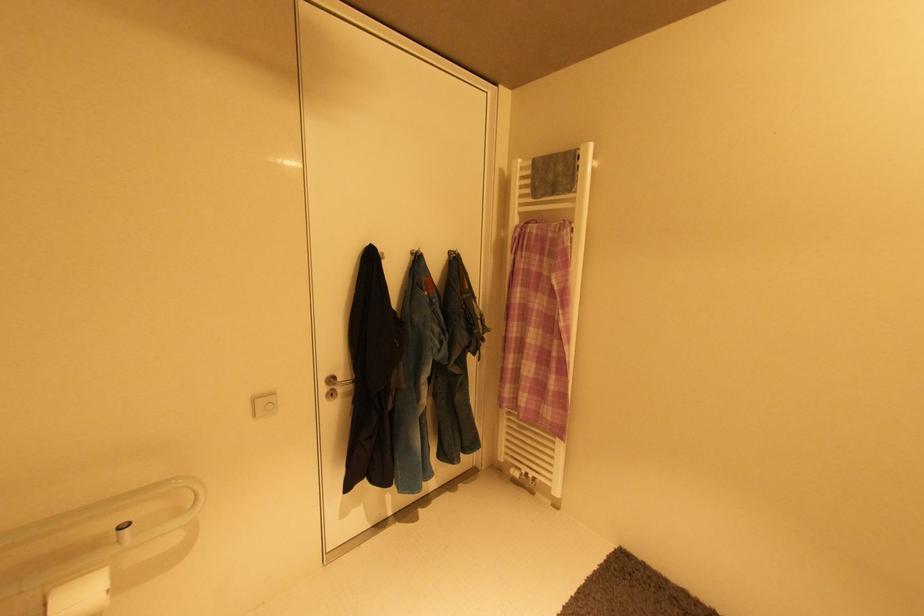
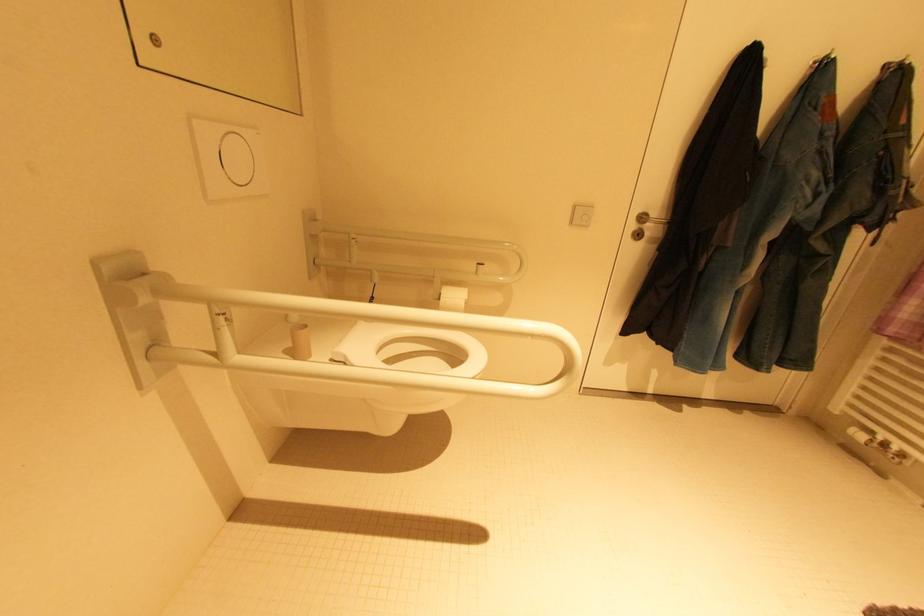
Question: The images are taken continuously from a first-person perspective. In which direction is your viewpoint rotating?

Choices:
 (A) Left
 (B) Right
 (C) Up
 (D) Down

Answer: (A)